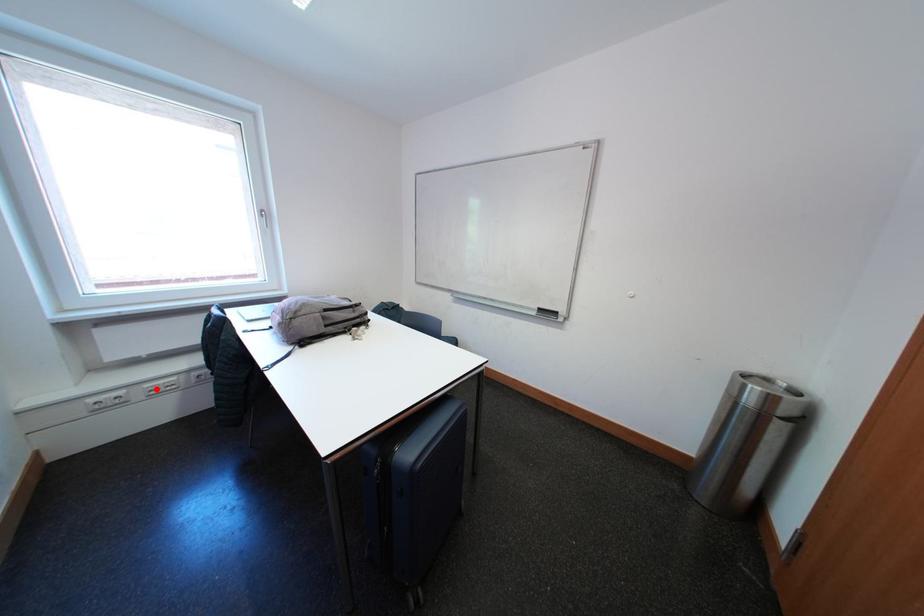
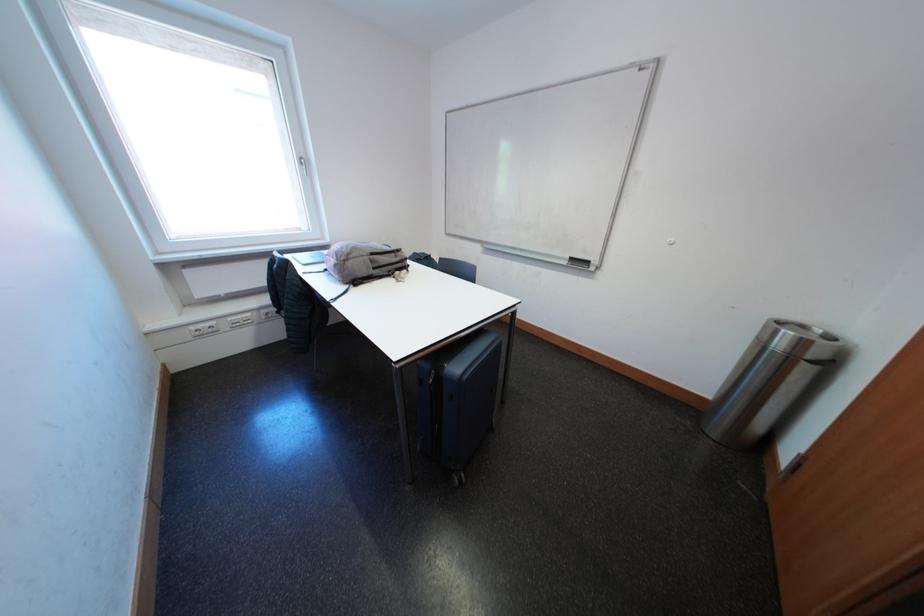
In the second image, find the point that corresponds to the highlighted location in the first image.

(238, 322)